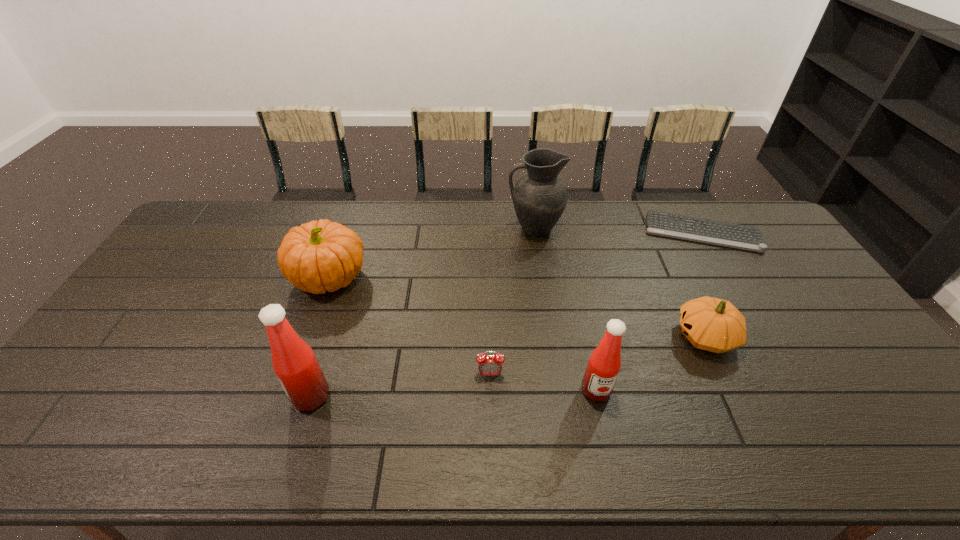
In the image, there is a desktop. Where is `vacant area at the far right corner`? The width and height of the screenshot is (960, 540). vacant area at the far right corner is located at coordinates (760, 214).

You are a GUI agent. You are given a task and a screenshot of the screen. Output one action in this format:
    pyautogui.click(x=<x>, y=<y>)
    Task: Click on the free space between the pitcher and the computer keyboard
    This screenshot has height=540, width=960.
    Given the screenshot: What is the action you would take?
    pyautogui.click(x=618, y=231)

You are a GUI agent. You are given a task and a screenshot of the screen. Output one action in this format:
    pyautogui.click(x=<x>, y=<y>)
    Task: Click on the vacant area between the taller condiment and the shorter condiment
    
    Given the screenshot: What is the action you would take?
    pyautogui.click(x=453, y=393)

Find the location of a particular element. free spot between the taller condiment and the alarm clock is located at coordinates (400, 385).

Where is `vacant space that is in between the pitcher and the left condiment`? The image size is (960, 540). vacant space that is in between the pitcher and the left condiment is located at coordinates (422, 312).

The image size is (960, 540). I want to click on vacant area that lies between the pumpkin and the computer keyboard, so [x=516, y=255].

Locate an element on the screen. This screenshot has width=960, height=540. free space between the pitcher and the left condiment is located at coordinates pyautogui.click(x=422, y=312).

At what (x,y) coordinates should I click in order to perform the action: click on free area in between the gourd and the pumpkin. Please return your answer as a coordinate pair (x, y). This screenshot has width=960, height=540. Looking at the image, I should click on (517, 307).

Locate an element on the screen. The height and width of the screenshot is (540, 960). vacant area between the pitcher and the right condiment is located at coordinates (565, 309).

Where is `unoccupied area between the left condiment and the second shortest object`? The width and height of the screenshot is (960, 540). unoccupied area between the left condiment and the second shortest object is located at coordinates (400, 385).